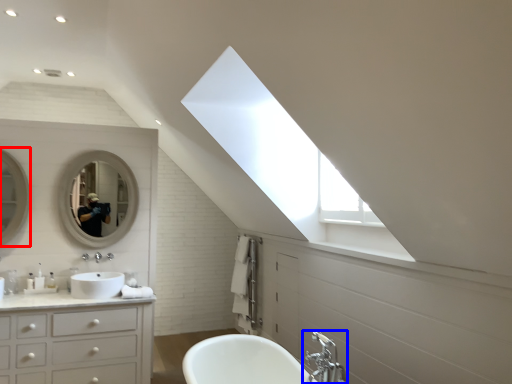
Question: Which of the following is the closest to the observer, mirror (highlighted by a red box) or tap (highlighted by a blue box)?

Choices:
 (A) mirror
 (B) tap

Answer: (B)